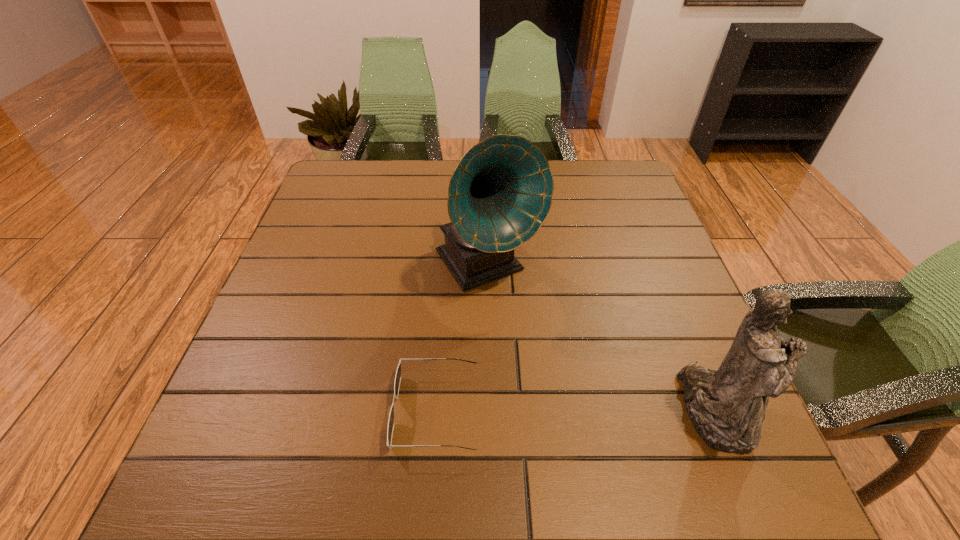
In order to click on sunglasses in this screenshot , I will do `click(398, 373)`.

Where is `figurine`? The height and width of the screenshot is (540, 960). figurine is located at coordinates (727, 406).

Image resolution: width=960 pixels, height=540 pixels. Find the location of `the rightmost object`. the rightmost object is located at coordinates (727, 406).

At what (x,y) coordinates should I click in order to perform the action: click on the tallest object. Please return your answer as a coordinate pair (x, y). The width and height of the screenshot is (960, 540). Looking at the image, I should click on (500, 193).

I want to click on phonograph_record, so point(500,193).

Find the location of `vacant space located on the front-facing side of the sunglasses`. vacant space located on the front-facing side of the sunglasses is located at coordinates (307, 411).

This screenshot has height=540, width=960. Identify the location of free spot located on the front-facing side of the sunglasses. pos(362,411).

Find the location of a particular element. blank area located on the front-facing side of the sunglasses is located at coordinates (229, 411).

Locate an element on the screen. The image size is (960, 540). vacant region located 0.340m from the horn of the phonograph_record is located at coordinates (611, 434).

The image size is (960, 540). I want to click on vacant space positioned 0.260m from the horn of the phonograph_record, so click(584, 397).